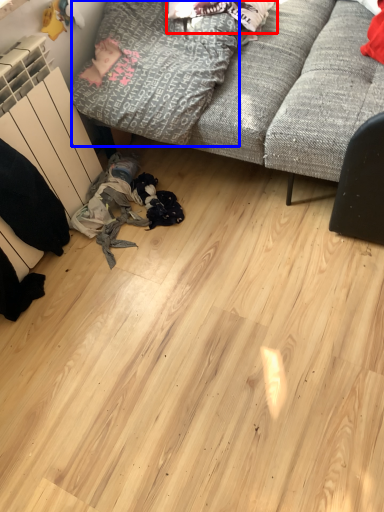
Question: Which object appears closest to the camera in this image, clothing (highlighted by a red box) or clothing (highlighted by a blue box)?

Choices:
 (A) clothing
 (B) clothing

Answer: (B)